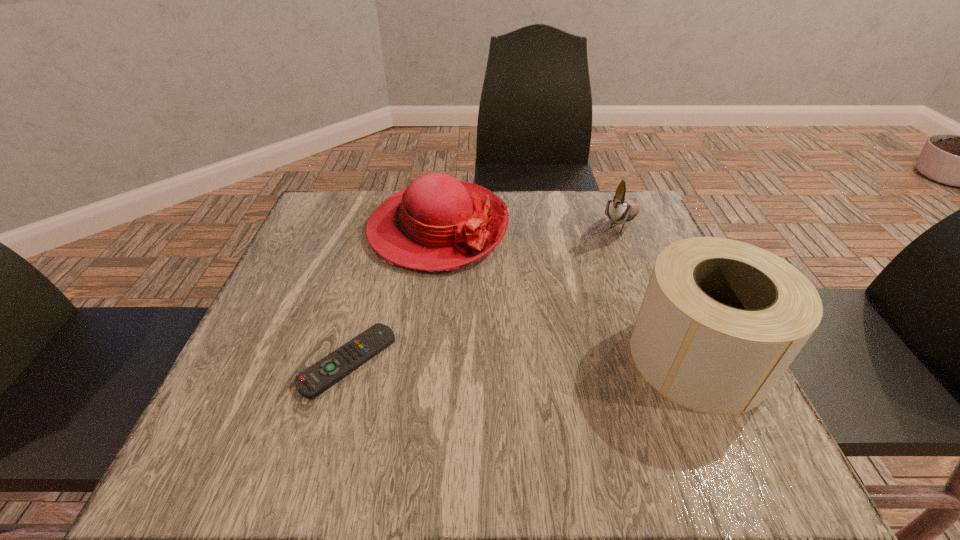
Find the location of a particular element. free space on the desktop that is between the remote control and the toilet tissue and is positioned at the front of the hat with a bow is located at coordinates (576, 358).

Identify the location of vacant space on the desktop that is between the remote control and the toilet tissue and is positioned at the face of the bird. Image resolution: width=960 pixels, height=540 pixels. (531, 359).